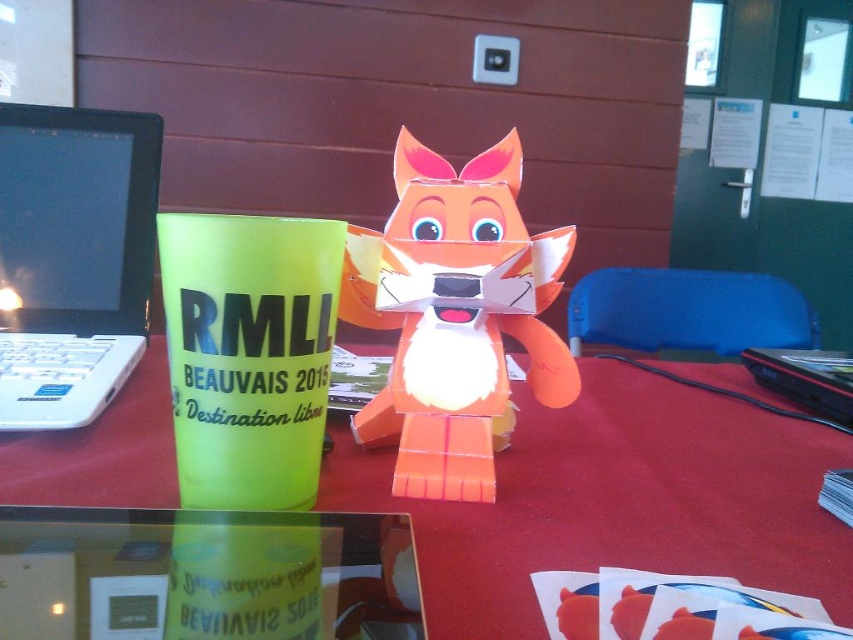
You are a person who is 6 feet tall and wants to sit at the matte plastic table at center. There is a blue plastic chair at center available. Can you comfortably sit at the table using the chair?

The distance between the matte plastic table at center and the blue plastic chair at center is 37.91 inches. Since the average comfortable sitting distance is about 24 to 30 inches, this distance is too far for comfortable seating. You would need to move the chair closer.

What object is located at the coordinates point (454, 314)?

The orange cardboard fox at center is located at the coordinates point (454, 314).